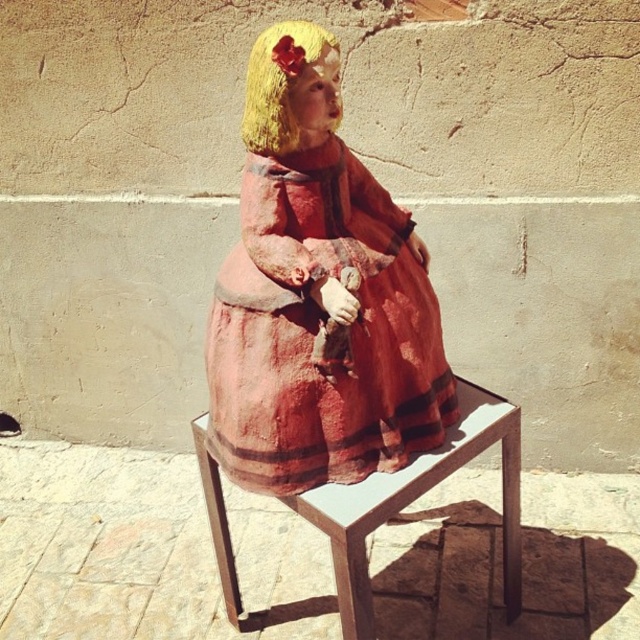
Consider the image. You are a photographer standing 4 feet away from the matte clay doll at center. You want to take a closeup shot of the doll. Can you move closer to the doll to get a better shot without exceeding the allowed distance of 4 feet? Explain your reasoning.

The matte clay doll at center and camera are 3.86 feet apart. Since 3.86 feet is less than 4 feet, you are already within the allowed distance and can take the closeup shot without moving closer.

You are an artist who wants to display both the matte clay doll at center and the matte red fabric dress at center in a showcase. Since the showcase has limited space, you need to know which object requires more space. Which object should be placed first to ensure it fits?

The matte clay doll at center is bigger than the matte red fabric dress at center, so you should place the matte clay doll at center first to ensure it fits in the showcase.

You are an interior designer arranging a living room. You have a matte red fabric dress at center and a wooden stool at center. Which object is on top of the other?

The matte red fabric dress at center is positioned over the wooden stool at center, so the dress is on top of the stool.